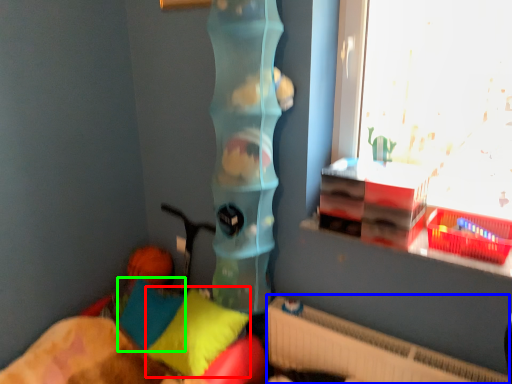
Question: Which object is the closest to the pillow (highlighted by a red box)? Choose among these: radiator (highlighted by a blue box) or pillow (highlighted by a green box).

Choices:
 (A) radiator
 (B) pillow

Answer: (B)